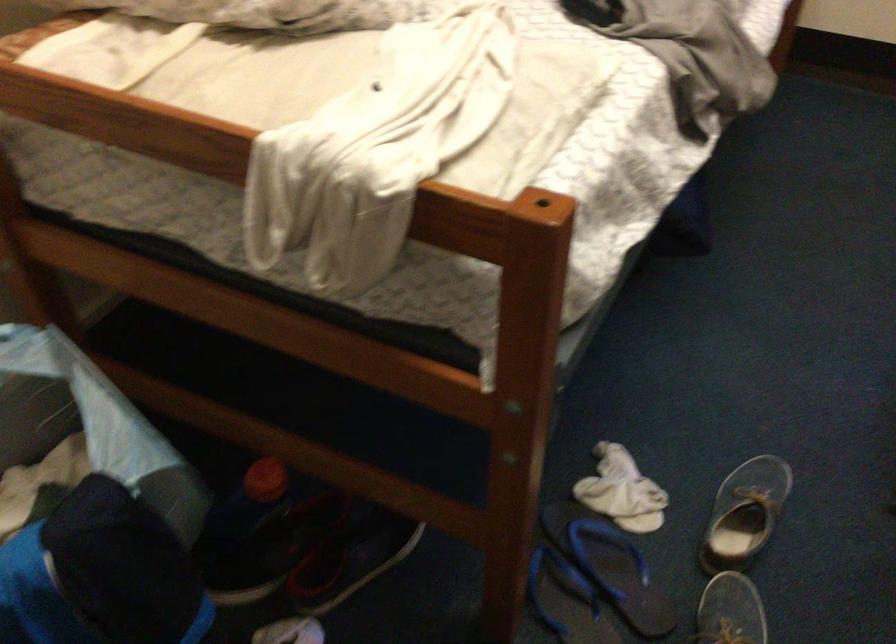
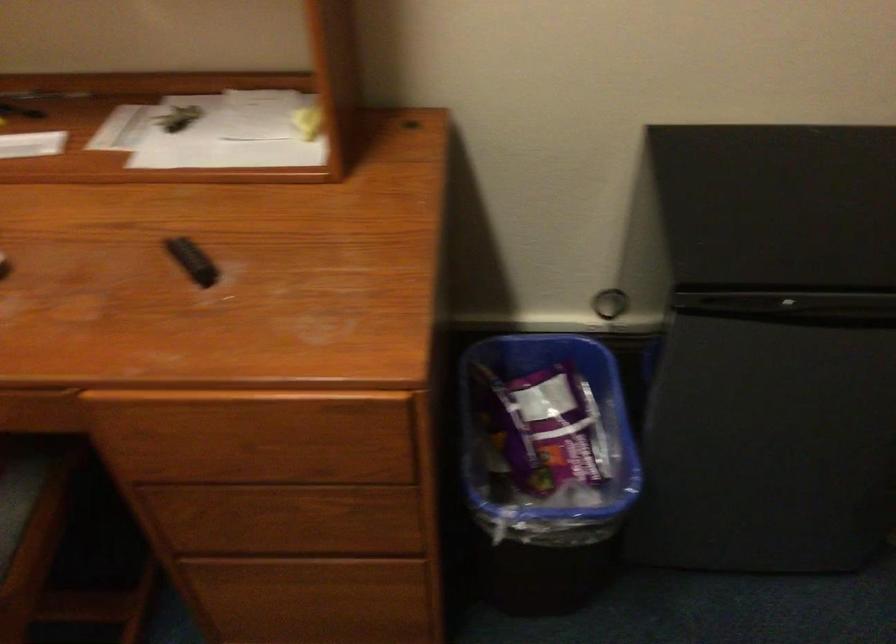
The first image is from the beginning of the video and the second image is from the end. How did the camera likely rotate when shooting the video?

The camera's rotation is toward right-down.